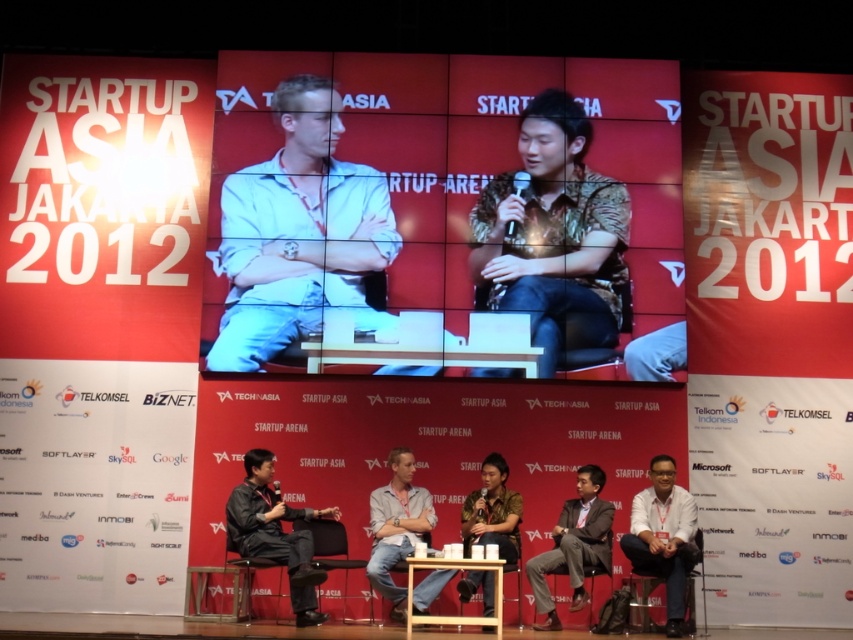
Locate an element on the screen. The width and height of the screenshot is (853, 640). brown textured shirt at center is located at coordinates (553, 236).

Is point (567, 273) positioned in front of point (556, 548)?

No, it is behind (556, 548).

In order to click on brown textured shirt at center in this screenshot , I will do `click(553, 236)`.

Does white matte shirt at lower right appear under wooden at center?

No.

Does white matte shirt at lower right have a greater width compared to wooden at center?

Indeed, white matte shirt at lower right has a greater width compared to wooden at center.

Which is behind, point (648, 518) or point (384, 592)?

Point (648, 518)

I want to click on white matte shirt at lower right, so click(x=663, y=538).

Is point (257, 164) farther from camera compared to point (547, 616)?

Yes, point (257, 164) is behind point (547, 616).

Can you confirm if light blue denim jeans at center is taller than matte black chair at lower right?

Incorrect, light blue denim jeans at center's height is not larger of matte black chair at lower right's.

Is point (228, 368) positioned behind point (527, 572)?

Yes, point (228, 368) is behind point (527, 572).

The width and height of the screenshot is (853, 640). What are the coordinates of `light blue denim jeans at center` in the screenshot? It's located at (300, 236).